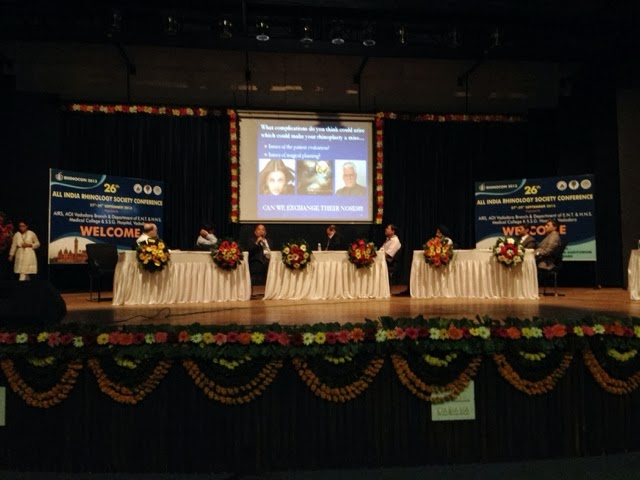
Identify the location of stage. 319,313.